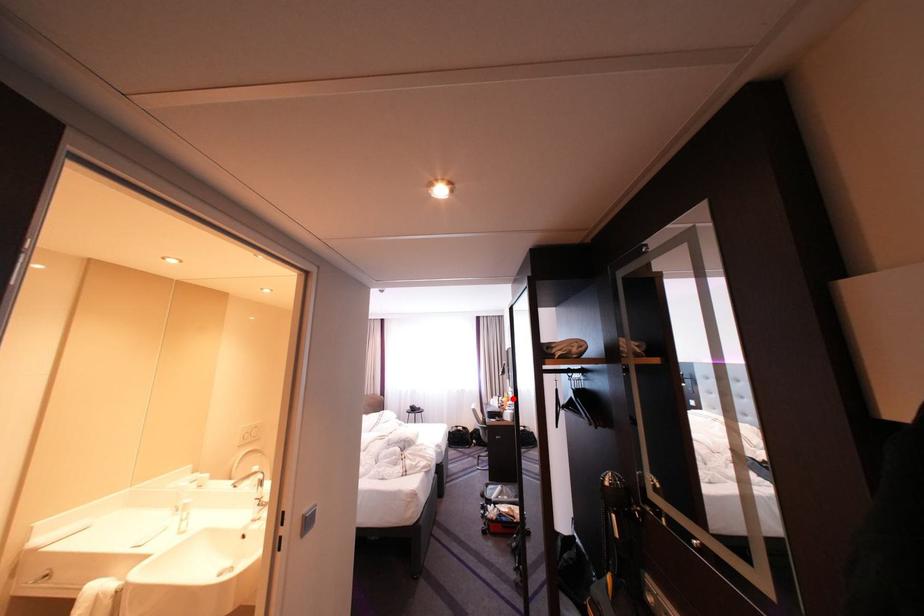
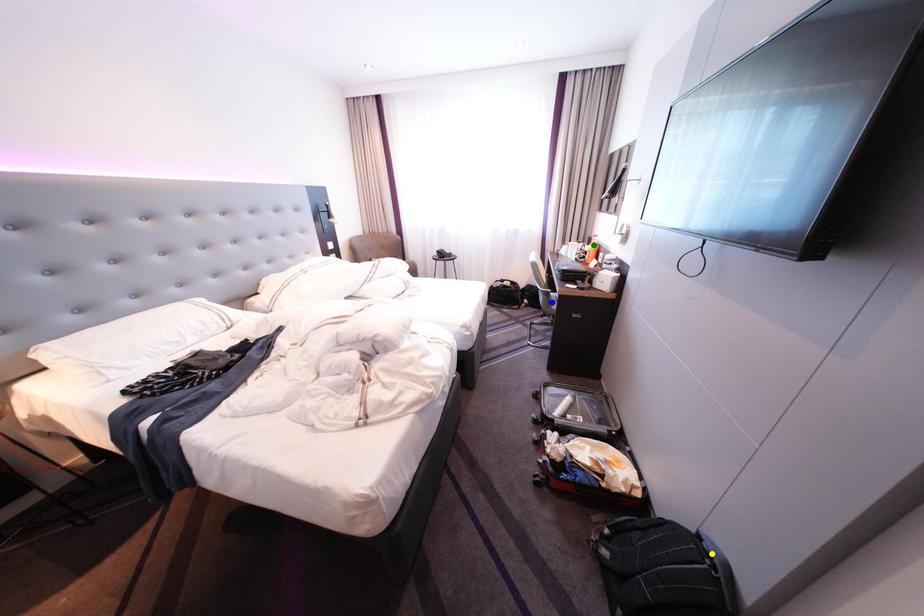
Question: I am providing you with two images of the same scene from different viewpoints. A red point is marked on the first image. You are given multiple points on the second image. In image 2, which mark is for the same physical point as the one in image 1?

Choices:
 (A) green point
 (B) yellow point
 (C) blue point

Answer: (A)